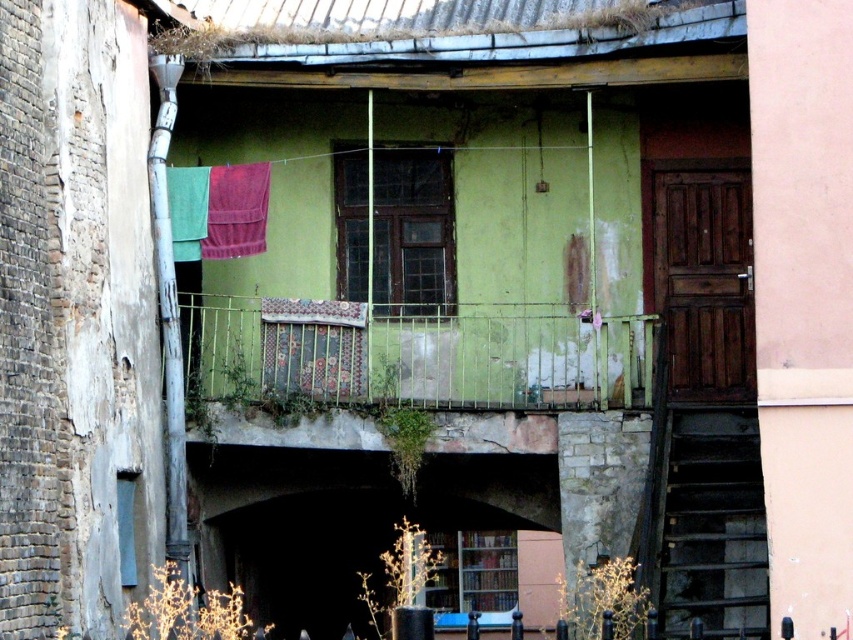
You are a painter who needs to hang a 1.2 meter wide canvas between the green metal railing at center and the floral fabric curtain at center. Can you fit it there?

The distance between the green metal railing at center and the floral fabric curtain at center is 1.09 meters, which is shorter than the 1.2 meter wide canvas. Therefore, the canvas cannot be placed between them.

You are standing in front of the building and notice the green metal railing at center and the floral fabric curtain at center. From your perspective, which object is positioned to the right?

The green metal railing at center is to the right of the floral fabric curtain at center.

You are a window cleaner who needs to decide which curtain to avoid spraying water on first. The floral fabric curtain at center and the velvet pink curtain at upper left are both in your view. Which curtain is bigger and requires more time to clean?

The floral fabric curtain at center is larger in size than the velvet pink curtain at upper left, so it requires more time to clean.